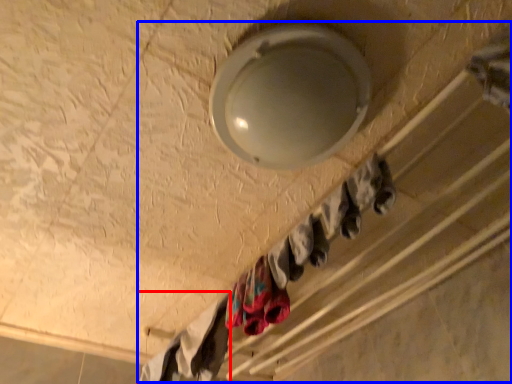
Question: Among these objects, which one is nearest to the camera, clothing (highlighted by a red box) or closet (highlighted by a blue box)?

Choices:
 (A) clothing
 (B) closet

Answer: (B)